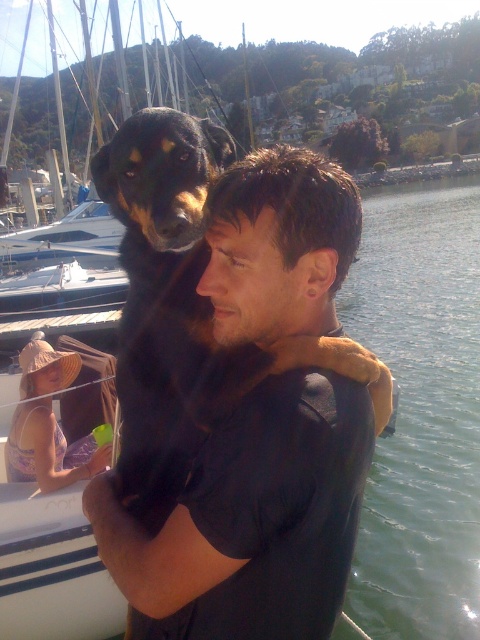
Who is higher up, green water at center or black fur dog at center?

green water at center is above.

Is point (423, 461) in front of point (193, 257)?

No, it is behind (193, 257).

Where is `green water at center`? green water at center is located at coordinates (420, 412).